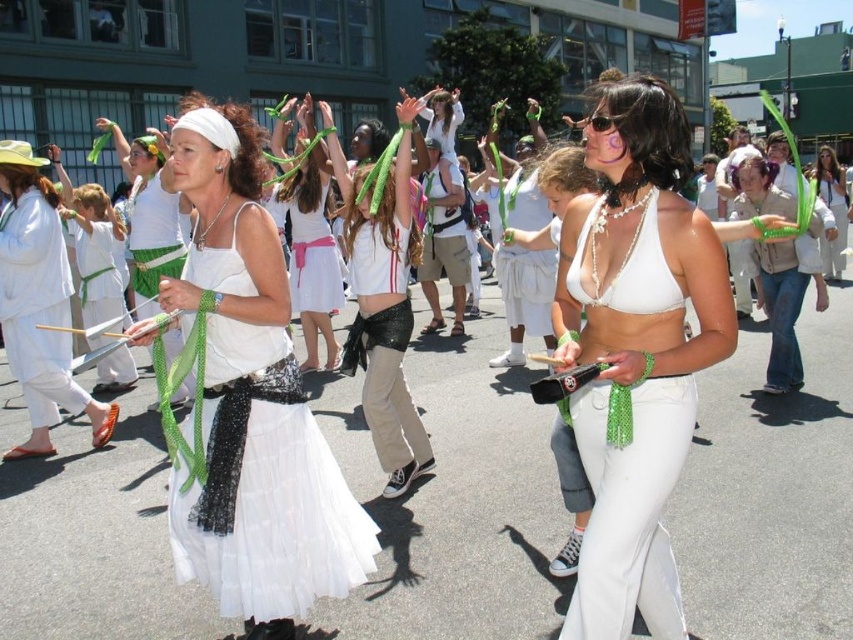
You are a photographer trying to capture both the shiny black skirt at center and the white fabric skirt at center in a single frame. Which skirt should you focus on first to ensure both are visible?

The shiny black skirt at center occupies less space than the white fabric skirt at center, so you should focus on the shiny black skirt at center first to ensure both are visible in the frame.

You are a photographer at the parade and want to capture both the white sequined skirt at center and the white satin dress at center in one frame. Which one should you focus on first to ensure they are both in the shot?

The white sequined skirt at center is to the right of the white satin dress at center, so focusing on the white satin dress at center first would allow you to frame both objects since they are positioned side by side.

You are a photographer trying to capture both the white tulle skirt at center and the white fabric skirt at center in a single shot. Given that your camera has a maximum focus range of 12 feet, will you be able to capture both in focus?

The white tulle skirt at center and the white fabric skirt at center are 13.13 feet apart, which exceeds the camera maximum focus range of 12 feet. Therefore, you won not be able to capture both in focus.